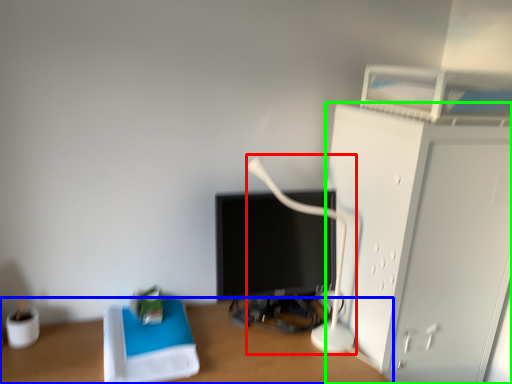
Question: Based on their relative distances, which object is nearer to table lamp (highlighted by a red box)? Choose from desk (highlighted by a blue box) and furniture (highlighted by a green box).

Choices:
 (A) desk
 (B) furniture

Answer: (B)